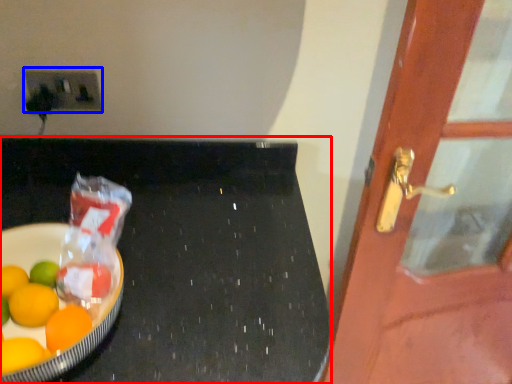
Question: Which object is further to the camera taking this photo, table (highlighted by a red box) or electric outlet (highlighted by a blue box)?

Choices:
 (A) table
 (B) electric outlet

Answer: (B)